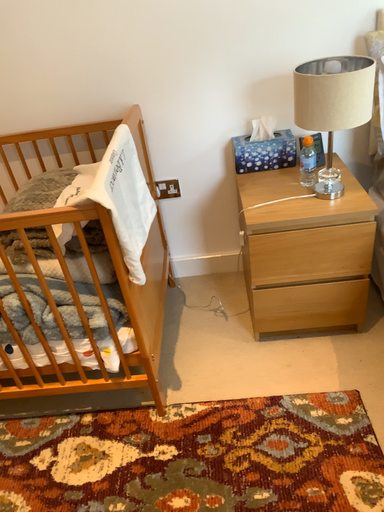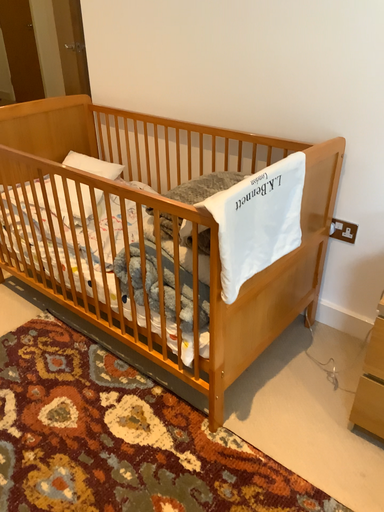
Question: How did the camera likely rotate when shooting the video?

Choices:
 (A) rotated right
 (B) rotated left

Answer: (B)